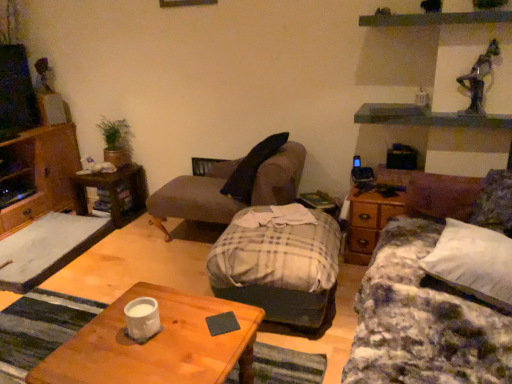
Locate an element on the screen. This screenshot has width=512, height=384. spots to the right of white matte coffee cup at lower left is located at coordinates (186, 333).